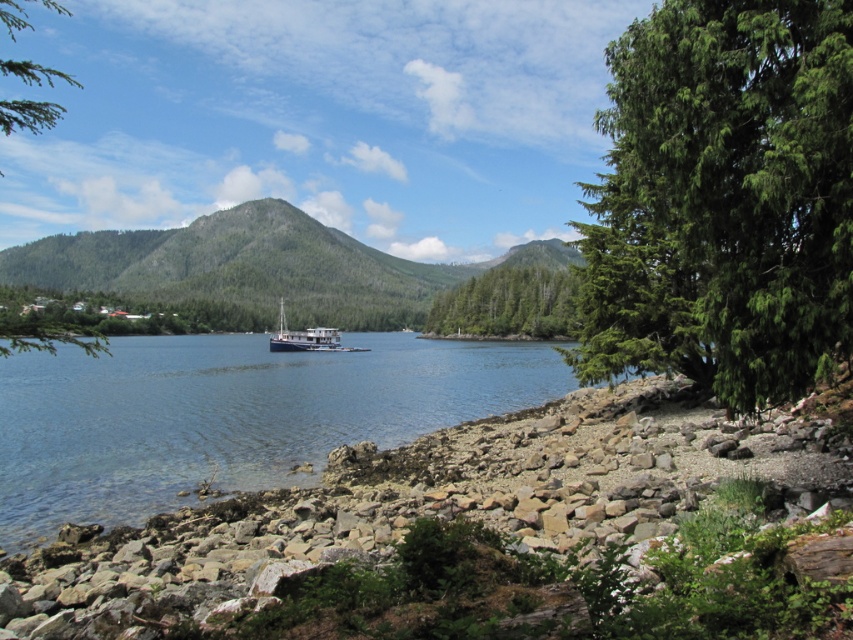
Consider the image. Who is more forward, (241, 273) or (531, 284)?

Point (531, 284) is more forward.

Does green forested mountain at center appear on the left side of green textured tree at center?

Indeed, green forested mountain at center is positioned on the left side of green textured tree at center.

Does point (204, 216) come in front of point (476, 310)?

No.

You are a GUI agent. You are given a task and a screenshot of the screen. Output one action in this format:
    pyautogui.click(x=<x>, y=<y>)
    Task: Click on the green forested mountain at center
    
    Given the screenshot: What is the action you would take?
    pyautogui.click(x=258, y=268)

Who is shorter, green leafy tree at right or clear blue water at center?

With less height is clear blue water at center.

Which is behind, point (726, 252) or point (322, 412)?

Point (322, 412)

You are a GUI agent. You are given a task and a screenshot of the screen. Output one action in this format:
    pyautogui.click(x=<x>, y=<y>)
    Task: Click on the green leafy tree at right
    Image resolution: width=853 pixels, height=640 pixels.
    Given the screenshot: What is the action you would take?
    pyautogui.click(x=724, y=198)

Can you confirm if green textured tree at center is positioned below blue matte boat at center?

Actually, green textured tree at center is above blue matte boat at center.

Can you confirm if green textured tree at center is bigger than blue matte boat at center?

Indeed, green textured tree at center has a larger size compared to blue matte boat at center.

Does point (534, 266) lie behind point (323, 348)?

Yes, point (534, 266) is farther from viewer.

The height and width of the screenshot is (640, 853). What are the coordinates of `green textured tree at center` in the screenshot? It's located at (508, 304).